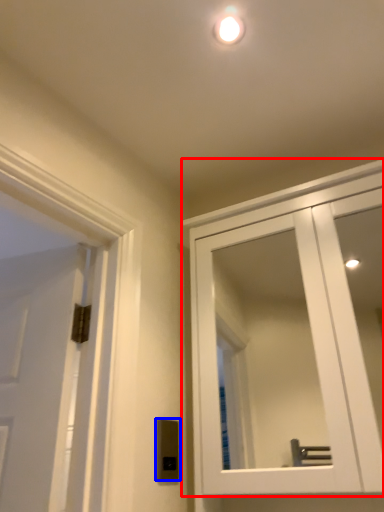
Question: Which object is closer to the camera taking this photo, cabinetry (highlighted by a red box) or light switch (highlighted by a blue box)?

Choices:
 (A) cabinetry
 (B) light switch

Answer: (A)